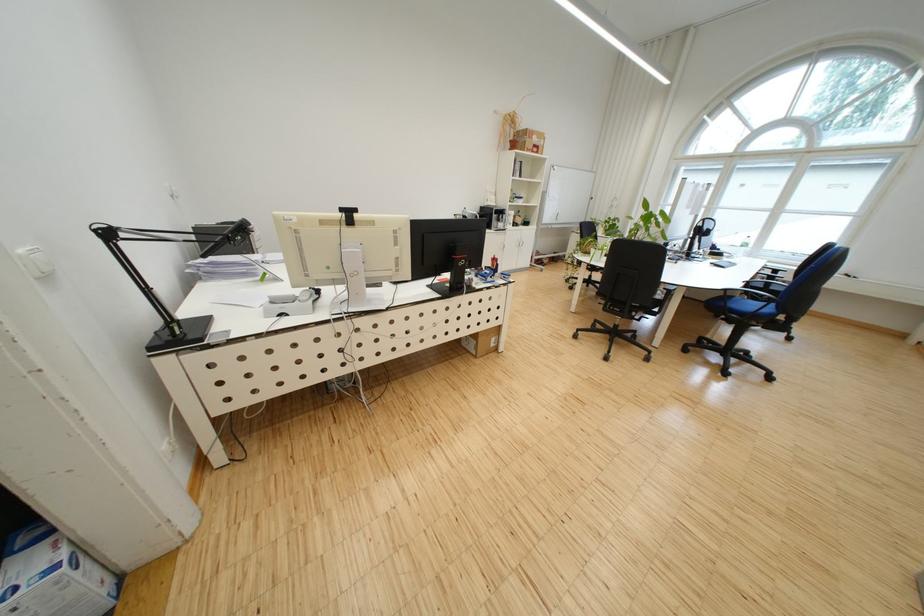
Image resolution: width=924 pixels, height=616 pixels. What do you see at coordinates (768, 283) in the screenshot?
I see `the black chair armrest` at bounding box center [768, 283].